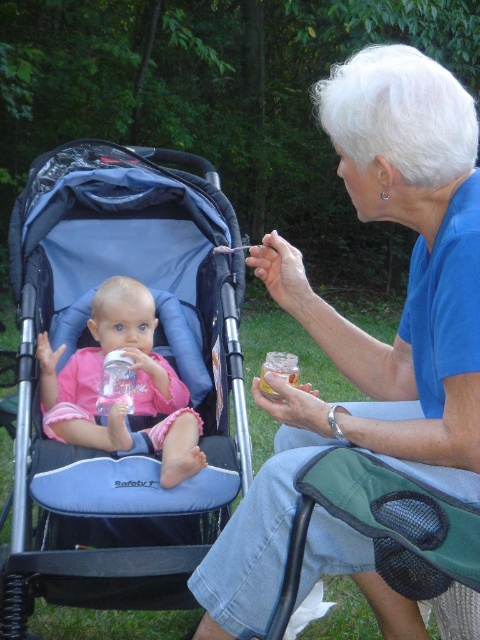
In the scene shown: Does pink fabric baby at center come behind clear plastic bottle at left?

No.

Does pink fabric baby at center appear over clear plastic bottle at left?

Incorrect, pink fabric baby at center is not positioned above clear plastic bottle at left.

The height and width of the screenshot is (640, 480). What do you see at coordinates (134, 388) in the screenshot?
I see `pink fabric baby at center` at bounding box center [134, 388].

I want to click on pink fabric baby at center, so click(x=134, y=388).

Does blue fabric stroller at upper left have a greater height compared to clear plastic bottle at left?

Yes.

Can you confirm if blue fabric stroller at upper left is shorter than clear plastic bottle at left?

No, blue fabric stroller at upper left is not shorter than clear plastic bottle at left.

Image resolution: width=480 pixels, height=640 pixels. What do you see at coordinates (362, 330) in the screenshot?
I see `blue fabric stroller at upper left` at bounding box center [362, 330].

What are the coordinates of `blue fabric stroller at upper left` in the screenshot? It's located at (362, 330).

Does blue fabric stroller at left appear under pink fabric baby at center?

Actually, blue fabric stroller at left is above pink fabric baby at center.

Can you confirm if blue fabric stroller at left is positioned to the right of pink fabric baby at center?

Incorrect, blue fabric stroller at left is not on the right side of pink fabric baby at center.

Image resolution: width=480 pixels, height=640 pixels. What are the coordinates of `blue fabric stroller at left` in the screenshot? It's located at (157, 353).

Find the location of a particular element. blue fabric stroller at left is located at coordinates [x=157, y=353].